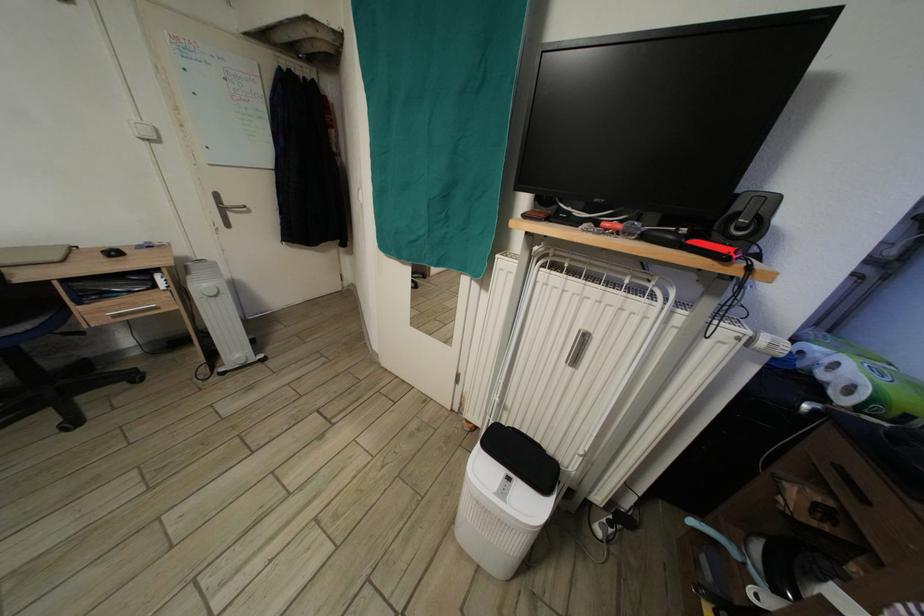
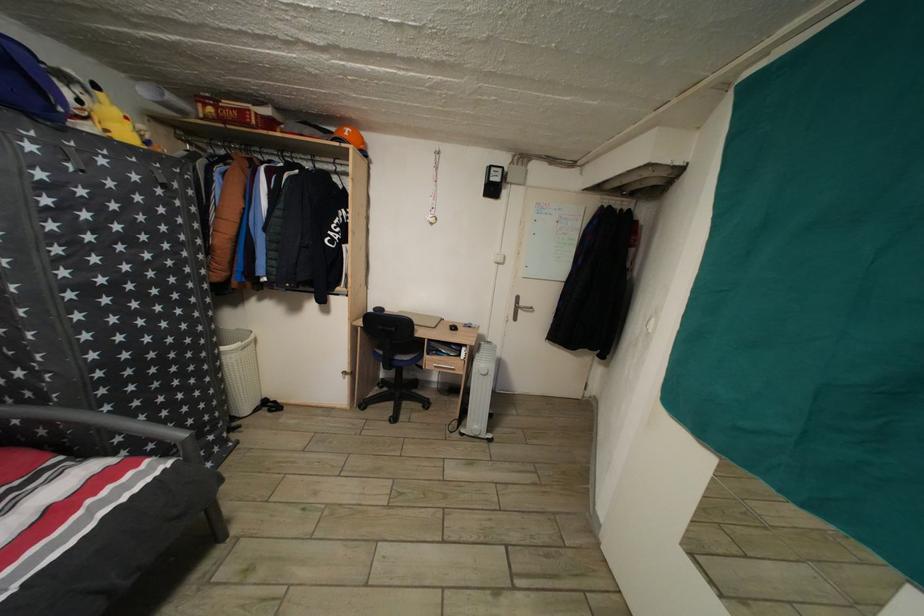
In the second image, find the point that corresponds to (141,124) in the first image.

(505, 257)